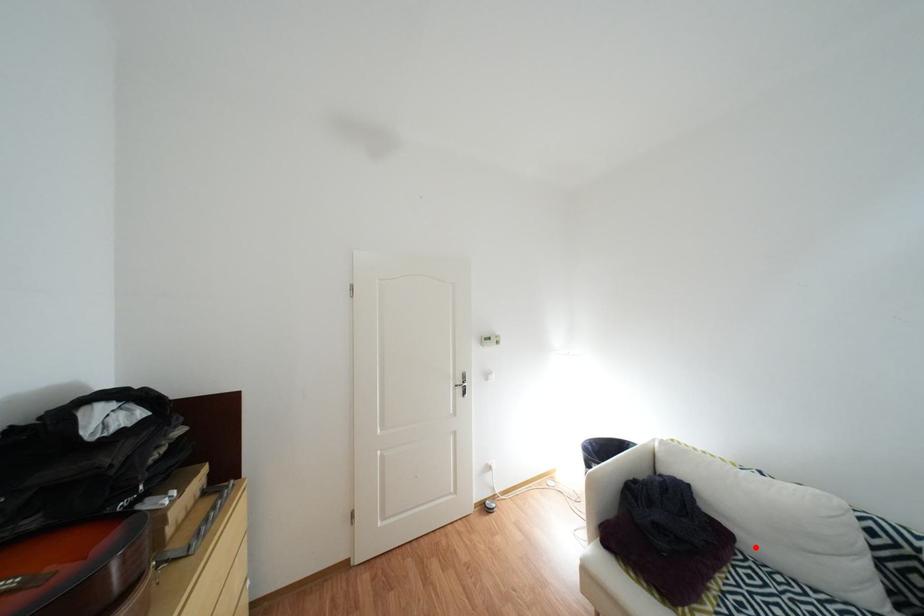
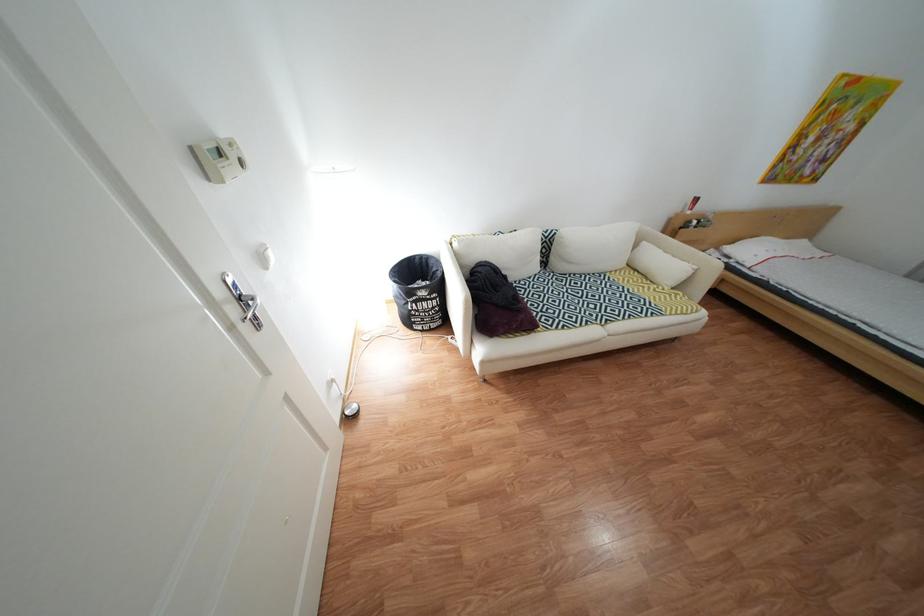
Find the pixel in the second image that matches the highlighted location in the first image.

(525, 281)